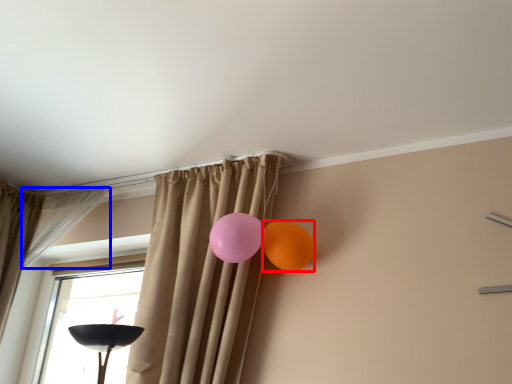
Question: Among these objects, which one is farthest to the camera, balloon (highlighted by a red box) or curtain (highlighted by a blue box)?

Choices:
 (A) balloon
 (B) curtain

Answer: (B)